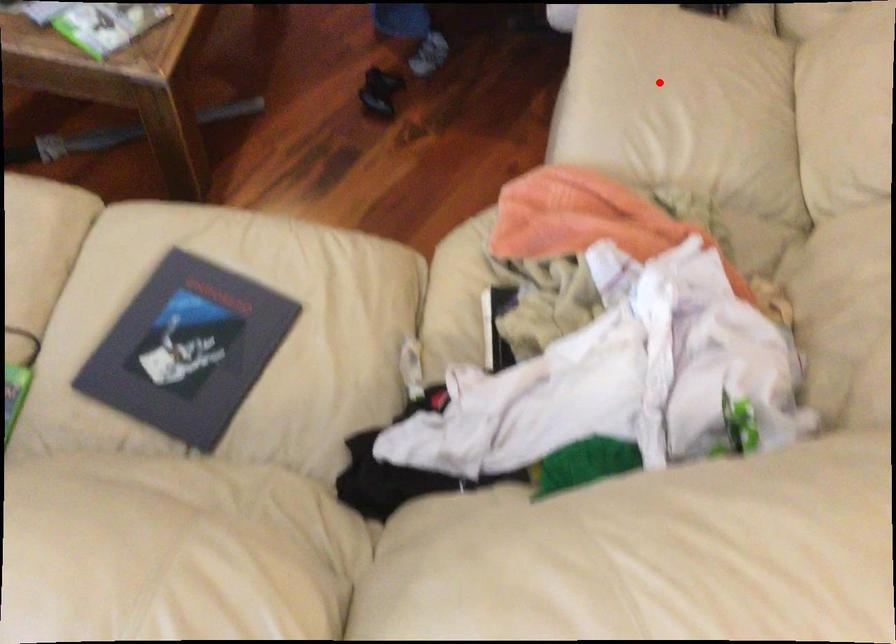
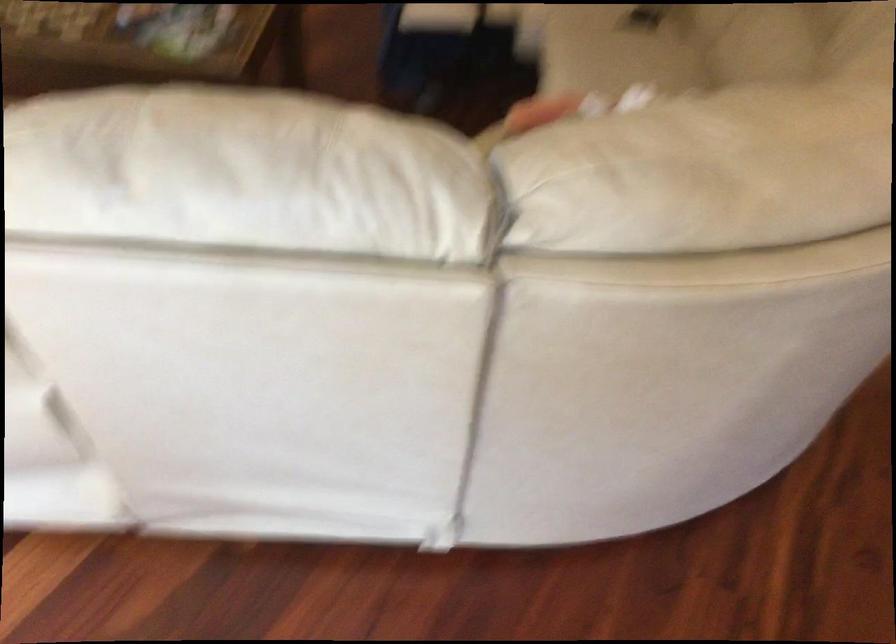
In the second image, find the point that corresponds to the highlighted location in the first image.

(616, 49)